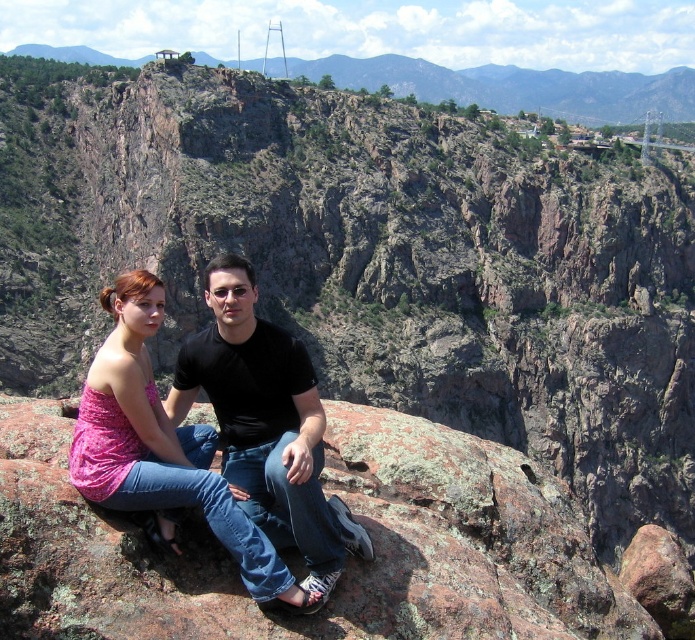
You are a photographer trying to capture the black matte shirt at center in your shot. The camera is positioned at the point with coordinates [265,422]. Where should you direct your camera to focus to ensure the black matte shirt at center is in the frame?

The point at [265,422] marks the location of the black matte shirt at center, so directing the camera to focus on that point will ensure the black matte shirt at center is in the frame.

You are an artist trying to sketch this scene. You have a canvas that can only accommodate objects up to the size of the rustic rock formation at upper center. Can the black matte shirt at center fit on your canvas without being cropped?

The black matte shirt at center is narrower than the rustic rock formation at upper center, so it can fit on the canvas without being cropped.